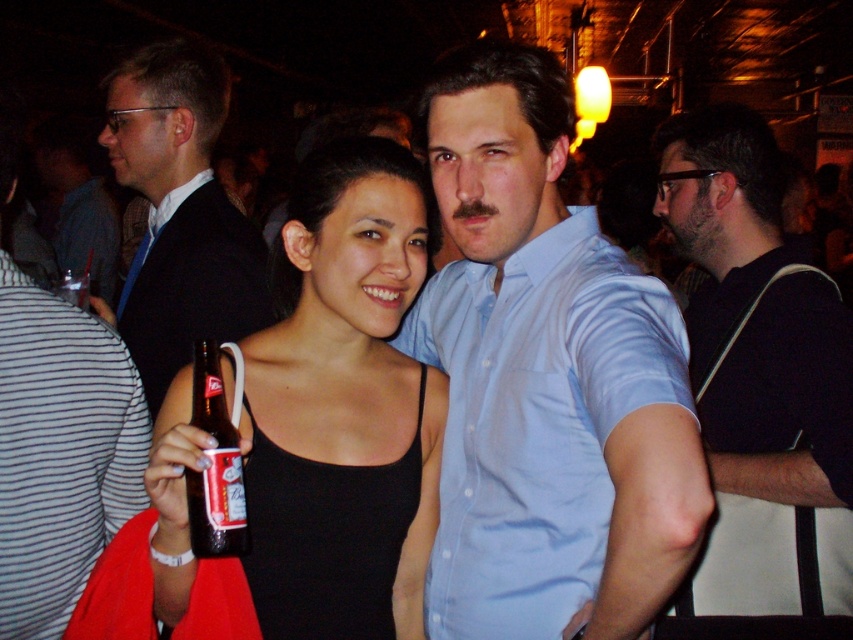
Can you confirm if light blue shirt at center is bigger than black matte tank top at center?

Yes, light blue shirt at center is bigger than black matte tank top at center.

Is light blue shirt at center behind black matte tank top at center?

No, it is in front of black matte tank top at center.

You are a GUI agent. You are given a task and a screenshot of the screen. Output one action in this format:
    pyautogui.click(x=<x>, y=<y>)
    Task: Click on the light blue shirt at center
    The height and width of the screenshot is (640, 853).
    Given the screenshot: What is the action you would take?
    pyautogui.click(x=544, y=378)

How distant is dark blue shirt at center from matte black suit at left?

The distance of dark blue shirt at center from matte black suit at left is 3.49 feet.

Image resolution: width=853 pixels, height=640 pixels. I want to click on dark blue shirt at center, so click(x=759, y=390).

Which is in front, point (819, 356) or point (155, 410)?

Point (819, 356)

This screenshot has width=853, height=640. In order to click on dark blue shirt at center in this screenshot , I will do `click(759, 390)`.

Between light blue shirt at center and striped fabric shirt at left, which one appears on the right side from the viewer's perspective?

light blue shirt at center

Locate an element on the screen. This screenshot has height=640, width=853. light blue shirt at center is located at coordinates coord(544,378).

Image resolution: width=853 pixels, height=640 pixels. What do you see at coordinates (544, 378) in the screenshot?
I see `light blue shirt at center` at bounding box center [544, 378].

In order to click on light blue shirt at center in this screenshot , I will do click(544, 378).